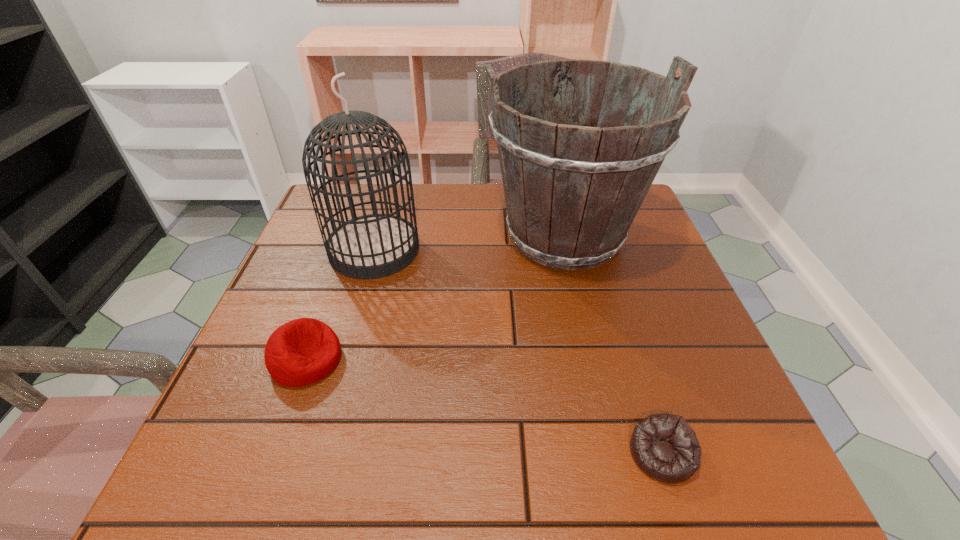
Where is `free spot between the third farthest object and the birdcage`? The image size is (960, 540). free spot between the third farthest object and the birdcage is located at coordinates (340, 305).

Where is `free space between the right beanbag and the bucket`? This screenshot has width=960, height=540. free space between the right beanbag and the bucket is located at coordinates (613, 344).

You are a GUI agent. You are given a task and a screenshot of the screen. Output one action in this format:
    pyautogui.click(x=<x>, y=<y>)
    Task: Click on the empty space that is in between the right beanbag and the birdcage
    This screenshot has height=540, width=960.
    Given the screenshot: What is the action you would take?
    pyautogui.click(x=518, y=352)

At what (x,y) coordinates should I click in order to perform the action: click on free spot between the farther beanbag and the right beanbag. Please return your answer as a coordinate pair (x, y). This screenshot has width=960, height=540. Looking at the image, I should click on (484, 406).

Identify which object is the second closest to the birdcage. Please provide its 2D coordinates. Your answer should be formatted as a tuple, i.e. [(x, y)], where the tuple contains the x and y coordinates of a point satisfying the conditions above.

[(572, 192)]

Choose which object is the nearest neighbor to the nearer beanbag. Please provide its 2D coordinates. Your answer should be formatted as a tuple, i.e. [(x, y)], where the tuple contains the x and y coordinates of a point satisfying the conditions above.

[(572, 192)]

Identify the location of free space that satisfies the following two spatial constraints: 1. on the back side of the bucket; 2. on the left side of the birdcage. (378, 235).

Find the location of a particular element. This screenshot has height=540, width=960. free region that satisfies the following two spatial constraints: 1. on the seat area of the shorter beanbag; 2. on the left side of the second shortest object is located at coordinates (273, 454).

Identify the location of vacant area in the image that satisfies the following two spatial constraints: 1. on the front side of the birdcage; 2. on the left side of the nearest object. The image size is (960, 540). (316, 454).

Identify the location of free space that satisfies the following two spatial constraints: 1. on the seat area of the shortest object; 2. on the right side of the farther beanbag. The image size is (960, 540). (273, 454).